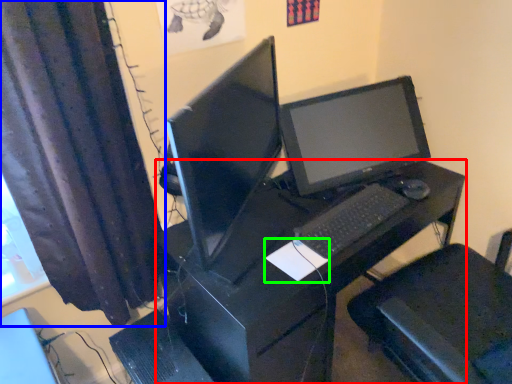
Question: Estimate the real-world distances between objects in this image. Which object is farther from desk (highlighted by a red box), curtain (highlighted by a blue box) or notepad (highlighted by a green box)?

Choices:
 (A) curtain
 (B) notepad

Answer: (A)